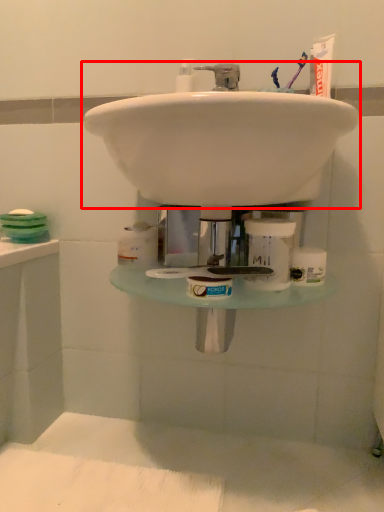
Question: Where is sink (annotated by the red box) located in relation to toiletry in the image?

Choices:
 (A) left
 (B) right

Answer: (A)